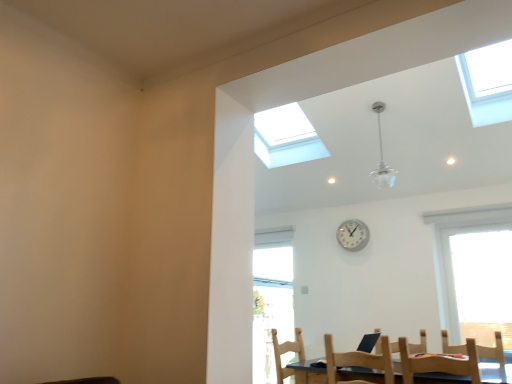
Identify the location of transparent glass window at upper right, the first window when ordered from right to left. Image resolution: width=512 pixels, height=384 pixels. tap(487, 82).

The image size is (512, 384). Describe the element at coordinates (439, 363) in the screenshot. I see `wooden chair at lower right, positioned as the second chair in right-to-left order` at that location.

In the scene shown: Measure the distance between white plastic clock at center and camera.

4.69 meters.

What do you see at coordinates (353, 235) in the screenshot?
I see `white plastic clock at center` at bounding box center [353, 235].

Describe the element at coordinates (358, 361) in the screenshot. This screenshot has width=512, height=384. I see `light brown wooden chair at lower center, which is counted as the 1th chair, starting from the left` at that location.

This screenshot has height=384, width=512. In order to click on light brown wooden chair at lower center, which is counted as the 1th chair, starting from the left in this screenshot , I will do `click(358, 361)`.

Identify the location of transparent glass window at upper right, which ranks as the second window in left-to-right order. The image size is (512, 384). (487, 82).

Is transparent glass skylight at upper center, placed as the 1th window when sorted from back to front, to the left of wooden chair at lower right, acting as the second chair starting from the left, from the viewer's perspective?

Yes, transparent glass skylight at upper center, placed as the 1th window when sorted from back to front, is to the left of wooden chair at lower right, acting as the second chair starting from the left.

Can you tell me how much transparent glass skylight at upper center, the 2th window viewed from the right, and wooden chair at lower right, acting as the second chair starting from the left, differ in facing direction?

84.9 degrees.

Which object is closer to the camera taking this photo, transparent glass skylight at upper center, which is the first window in left-to-right order, or wooden chair at lower right, positioned as the second chair in right-to-left order?

wooden chair at lower right, positioned as the second chair in right-to-left order, is more forward.

Is transparent glass skylight at upper center, placed as the 1th window when sorted from back to front, inside or outside of wooden chair at lower right, acting as the second chair starting from the left?

The correct answer is: outside.

Which of these two, wooden chair at lower right, which is counted as the 3th chair, starting from the left, or transparent glass window at upper right, which ranks as the second window in left-to-right order, is bigger?

With larger size is wooden chair at lower right, which is counted as the 3th chair, starting from the left.

Which is less distant, (502, 361) or (500, 55)?

Point (502, 361) is farther from the camera than point (500, 55).

Is wooden chair at lower right, which is counted as the 3th chair, starting from the left, positioned beyond the bounds of transparent glass window at upper right, the first window when ordered from right to left?

Absolutely, wooden chair at lower right, which is counted as the 3th chair, starting from the left, is external to transparent glass window at upper right, the first window when ordered from right to left.

Considering the positions of objects wooden chair at lower right, which is counted as the 3th chair, starting from the left, and transparent glass window at upper right, the first window positioned from the front, in the image provided, who is behind, wooden chair at lower right, which is counted as the 3th chair, starting from the left, or transparent glass window at upper right, the first window positioned from the front,?

transparent glass window at upper right, the first window positioned from the front.

Is light brown wooden chair at lower center, marked as the third chair in a right-to-left arrangement, to the left of wooden chair at lower right, acting as the second chair starting from the left, from the viewer's perspective?

Indeed, light brown wooden chair at lower center, marked as the third chair in a right-to-left arrangement, is positioned on the left side of wooden chair at lower right, acting as the second chair starting from the left.

Is light brown wooden chair at lower center, marked as the third chair in a right-to-left arrangement, with wooden chair at lower right, positioned as the second chair in right-to-left order?

No, light brown wooden chair at lower center, marked as the third chair in a right-to-left arrangement, is not in contact with wooden chair at lower right, positioned as the second chair in right-to-left order.

Could you measure the distance between light brown wooden chair at lower center, which is counted as the 1th chair, starting from the left, and wooden chair at lower right, acting as the second chair starting from the left?

26.56 centimeters.

From the picture: Which object is closer to the camera, light brown wooden chair at lower center, marked as the third chair in a right-to-left arrangement, or wooden chair at lower right, positioned as the second chair in right-to-left order?

light brown wooden chair at lower center, marked as the third chair in a right-to-left arrangement.

From a real-world perspective, is transparent glass window at upper right, the first window when ordered from right to left, located beneath transparent glass skylight at upper center, which is the first window in left-to-right order?

Indeed, from a real-world perspective, transparent glass window at upper right, the first window when ordered from right to left, is positioned beneath transparent glass skylight at upper center, which is the first window in left-to-right order.

Can you confirm if transparent glass window at upper right, the first window when ordered from right to left, is wider than transparent glass skylight at upper center, which is the first window in left-to-right order?

Correct, the width of transparent glass window at upper right, the first window when ordered from right to left, exceeds that of transparent glass skylight at upper center, which is the first window in left-to-right order.

Between transparent glass window at upper right, the first window positioned from the front, and transparent glass skylight at upper center, the second window positioned from the front, which one has more height?

Standing taller between the two is transparent glass window at upper right, the first window positioned from the front.

Is point (479, 112) positioned behind point (275, 136)?

No, it is in front of (275, 136).

Does transparent glass window at upper right, the second window from the back, turn towards clear glass chandelier at upper center?

No, transparent glass window at upper right, the second window from the back, is not turned towards clear glass chandelier at upper center.

Measure the distance between transparent glass window at upper right, the first window positioned from the front, and clear glass chandelier at upper center.

transparent glass window at upper right, the first window positioned from the front, and clear glass chandelier at upper center are 3.60 feet apart.

Based on the photo, considering the relative sizes of transparent glass window at upper right, which ranks as the second window in left-to-right order, and clear glass chandelier at upper center in the image provided, is transparent glass window at upper right, which ranks as the second window in left-to-right order, thinner than clear glass chandelier at upper center?

In fact, transparent glass window at upper right, which ranks as the second window in left-to-right order, might be wider than clear glass chandelier at upper center.

From a real-world perspective, is transparent glass window at upper right, the first window positioned from the front, located higher than wooden chair at lower right, acting as the second chair starting from the left?

Indeed, from a real-world perspective, transparent glass window at upper right, the first window positioned from the front, stands above wooden chair at lower right, acting as the second chair starting from the left.

Which object is positioned more to the left, transparent glass window at upper right, the second window from the back, or wooden chair at lower right, positioned as the second chair in right-to-left order?

Positioned to the left is wooden chair at lower right, positioned as the second chair in right-to-left order.

Can you tell me how much transparent glass window at upper right, which ranks as the second window in left-to-right order, and wooden chair at lower right, positioned as the second chair in right-to-left order, differ in facing direction?

85 degrees.

Is transparent glass window at upper right, the first window when ordered from right to left, oriented towards wooden chair at lower right, positioned as the second chair in right-to-left order?

No.

Is transparent glass skylight at upper center, the second window positioned from the front, bigger than wooden chair at lower right, acting as the first chair starting from the right?

Indeed, transparent glass skylight at upper center, the second window positioned from the front, has a larger size compared to wooden chair at lower right, acting as the first chair starting from the right.

Can you tell me how much transparent glass skylight at upper center, the second window positioned from the front, and wooden chair at lower right, acting as the first chair starting from the right, differ in facing direction?

They differ by 6.44 degrees in their facing directions.

Is point (254, 149) closer or farther from the camera than point (486, 352)?

Point (254, 149).

Considering the sizes of objects transparent glass skylight at upper center, which is the first window in left-to-right order, and wooden chair at lower right, which is counted as the 3th chair, starting from the left, in the image provided, who is taller, transparent glass skylight at upper center, which is the first window in left-to-right order, or wooden chair at lower right, which is counted as the 3th chair, starting from the left,?

With more height is transparent glass skylight at upper center, which is the first window in left-to-right order.

The width and height of the screenshot is (512, 384). I want to click on the 2nd window directly above the wooden chair at lower right, acting as the second chair starting from the left (from a real-world perspective), so click(286, 137).

From a real-world perspective, which chair is the 1st one underneath the transparent glass window at upper right, the second window from the back? Please provide its 2D coordinates.

[(494, 354)]

Which object lies nearer to the anchor point light brown wooden chair at lower center, marked as the third chair in a right-to-left arrangement, wooden chair at lower right, acting as the second chair starting from the left, or clear glass chandelier at upper center?

wooden chair at lower right, acting as the second chair starting from the left.

Considering their positions, is wooden chair at lower right, positioned as the second chair in right-to-left order, positioned further to wooden chair at lower right, acting as the first chair starting from the right, than transparent glass window at upper right, which ranks as the second window in left-to-right order?

transparent glass window at upper right, which ranks as the second window in left-to-right order, is positioned further to the anchor wooden chair at lower right, acting as the first chair starting from the right.

Looking at the image, which one is located closer to wooden chair at lower right, acting as the second chair starting from the left, white plastic clock at center or clear glass chandelier at upper center?

clear glass chandelier at upper center is closer to wooden chair at lower right, acting as the second chair starting from the left.

From the image, which object appears to be nearer to transparent glass window at upper right, which ranks as the second window in left-to-right order, light brown wooden chair at lower center, marked as the third chair in a right-to-left arrangement, or white plastic clock at center?

The object closer to transparent glass window at upper right, which ranks as the second window in left-to-right order, is white plastic clock at center.

Estimate the real-world distances between objects in this image. Which object is further from wooden chair at lower right, acting as the first chair starting from the right, clear glass chandelier at upper center or light brown wooden chair at lower center, which is counted as the 1th chair, starting from the left?

clear glass chandelier at upper center is further to wooden chair at lower right, acting as the first chair starting from the right.

In the scene shown: Estimate the real-world distances between objects in this image. Which object is closer to wooden chair at lower right, acting as the first chair starting from the right, wooden chair at lower right, positioned as the second chair in right-to-left order, or white plastic clock at center?

white plastic clock at center is closer to wooden chair at lower right, acting as the first chair starting from the right.

Looking at the image, which one is located further to white plastic clock at center, transparent glass window at upper right, the first window when ordered from right to left, or clear glass chandelier at upper center?

Based on the image, transparent glass window at upper right, the first window when ordered from right to left, appears to be further to white plastic clock at center.

From the image, which object appears to be nearer to wooden chair at lower right, acting as the first chair starting from the right, light brown wooden chair at lower center, marked as the third chair in a right-to-left arrangement, or white plastic clock at center?

Among the two, light brown wooden chair at lower center, marked as the third chair in a right-to-left arrangement, is located nearer to wooden chair at lower right, acting as the first chair starting from the right.

At what (x,y) coordinates should I click in order to perform the action: click on chair between transparent glass window at upper right, the first window positioned from the front, and wooden chair at lower right, positioned as the second chair in right-to-left order, vertically. Please return your answer as a coordinate pair (x, y). Looking at the image, I should click on (358, 361).

Where is `window between transparent glass window at upper right, the first window when ordered from right to left, and wooden chair at lower right, acting as the second chair starting from the left, in the up-down direction`? Image resolution: width=512 pixels, height=384 pixels. window between transparent glass window at upper right, the first window when ordered from right to left, and wooden chair at lower right, acting as the second chair starting from the left, in the up-down direction is located at coordinates (286, 137).

The image size is (512, 384). I want to click on chair between clear glass chandelier at upper center and wooden chair at lower right, acting as the second chair starting from the left, in the vertical direction, so click(358, 361).

This screenshot has width=512, height=384. Identify the location of chair between transparent glass skylight at upper center, which is the first window in left-to-right order, and wooden chair at lower right, acting as the second chair starting from the left, in the vertical direction. (358, 361).